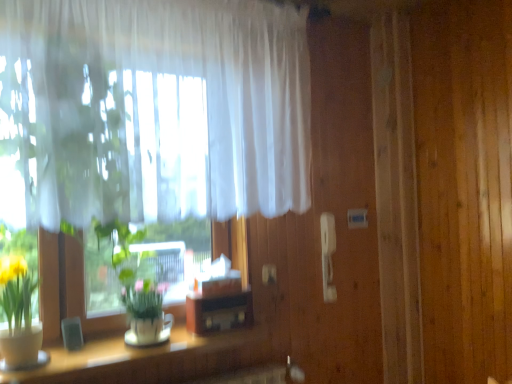
Question: Does wooden table at lower left come behind white sheer curtain at upper left?

Choices:
 (A) yes
 (B) no

Answer: (A)

Question: Does wooden table at lower left contain white sheer curtain at upper left?

Choices:
 (A) no
 (B) yes

Answer: (A)

Question: Would you consider wooden table at lower left to be distant from white sheer curtain at upper left?

Choices:
 (A) yes
 (B) no

Answer: (B)

Question: Does wooden table at lower left appear on the left side of white sheer curtain at upper left?

Choices:
 (A) no
 (B) yes

Answer: (B)

Question: From the image's perspective, does wooden table at lower left appear higher than white sheer curtain at upper left?

Choices:
 (A) yes
 (B) no

Answer: (B)

Question: Is wooden table at lower left with white sheer curtain at upper left?

Choices:
 (A) no
 (B) yes

Answer: (A)

Question: Considering the relative sizes of white sheer curtain at upper left and wooden table at lower left in the image provided, is white sheer curtain at upper left wider than wooden table at lower left?

Choices:
 (A) no
 (B) yes

Answer: (A)

Question: Is white sheer curtain at upper left to the right of wooden table at lower left from the viewer's perspective?

Choices:
 (A) yes
 (B) no

Answer: (A)

Question: Can you confirm if white sheer curtain at upper left is shorter than wooden table at lower left?

Choices:
 (A) yes
 (B) no

Answer: (B)

Question: Is white sheer curtain at upper left positioned with its back to wooden table at lower left?

Choices:
 (A) yes
 (B) no

Answer: (B)

Question: Considering the relative sizes of white sheer curtain at upper left and wooden table at lower left in the image provided, is white sheer curtain at upper left thinner than wooden table at lower left?

Choices:
 (A) no
 (B) yes

Answer: (B)

Question: Is white sheer curtain at upper left facing towards wooden table at lower left?

Choices:
 (A) yes
 (B) no

Answer: (B)

Question: Looking at the image, does wooden table at lower left seem bigger or smaller compared to white sheer curtain at upper left?

Choices:
 (A) small
 (B) big

Answer: (A)